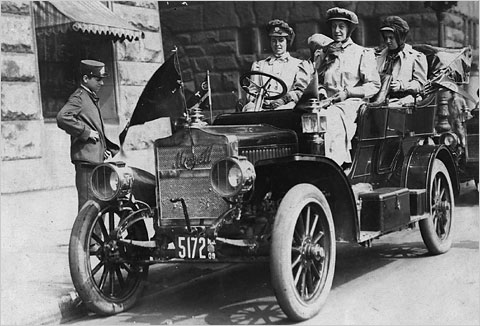
Locate an element on the screen. The width and height of the screenshot is (480, 326). window under canopy is located at coordinates (72, 47).